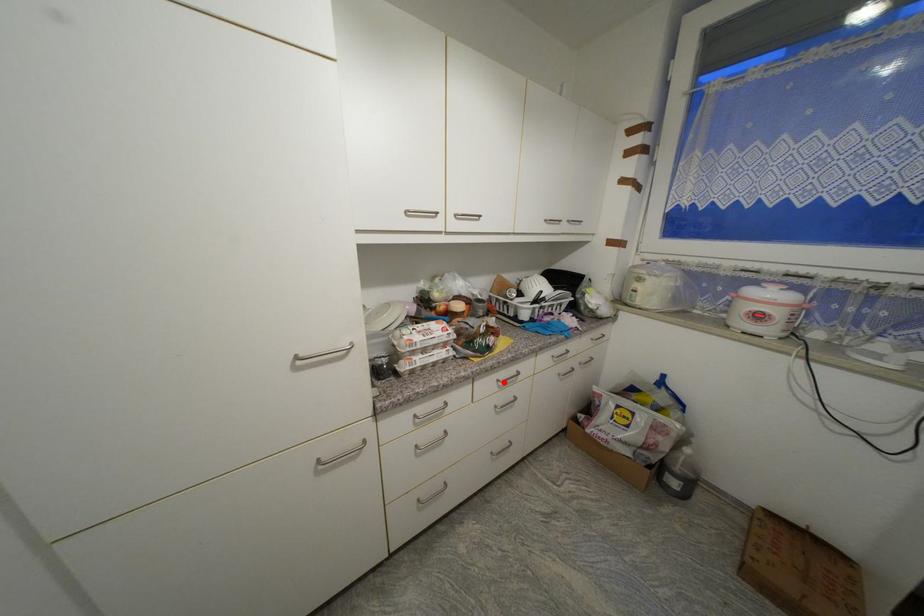
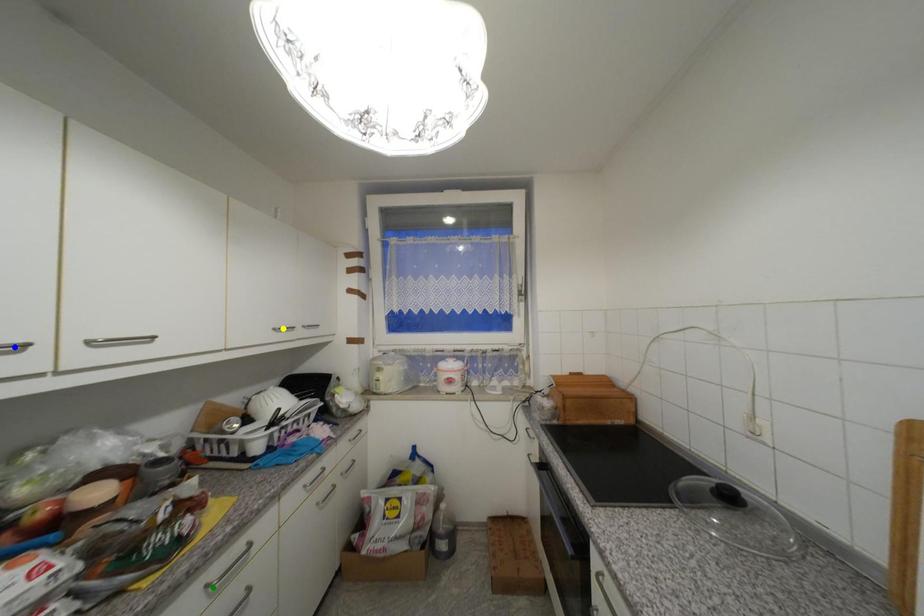
Question: I am providing you with two images of the same scene from different viewpoints. A red point is marked on the first image. You are given multiple points on the second image. Which mark in image 2 goes with the point in image 1?

Choices:
 (A) green point
 (B) blue point
 (C) yellow point

Answer: (A)